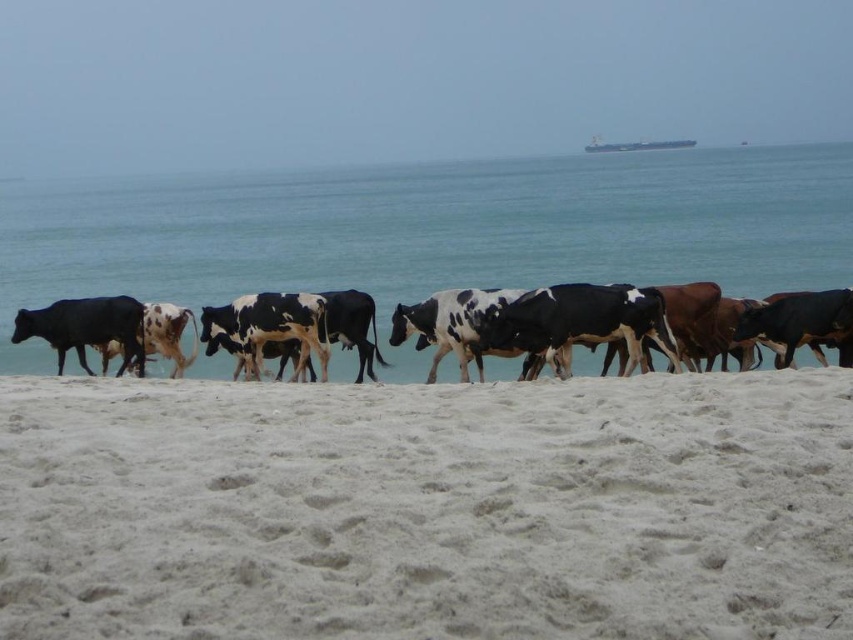
Is white sandy beach at lower center bigger than blue water at center?

No.

How much distance is there between white sandy beach at lower center and blue water at center?

44.38 meters

Is point (833, 468) positioned before point (641, 248)?

Yes, it is in front of point (641, 248).

The height and width of the screenshot is (640, 853). I want to click on white sandy beach at lower center, so click(427, 508).

Find the location of a particular element. The width and height of the screenshot is (853, 640). white sandy beach at lower center is located at coordinates (427, 508).

Which of these two, blue water at center or black glossy cow at left, stands taller?

With more height is blue water at center.

Describe the element at coordinates (433, 230) in the screenshot. I see `blue water at center` at that location.

Is point (384, 376) in front of point (129, 296)?

Yes.

The image size is (853, 640). In order to click on blue water at center in this screenshot , I will do `click(433, 230)`.